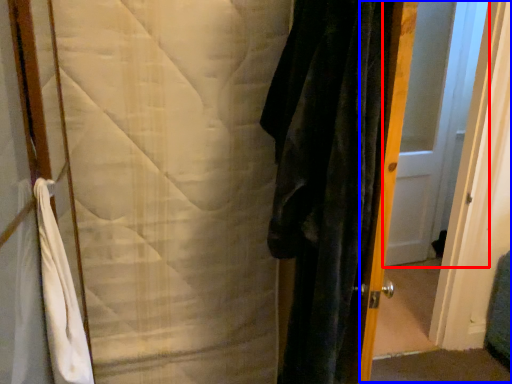
Question: Which object appears farthest to the camera in this image, door (highlighted by a red box) or screen door (highlighted by a blue box)?

Choices:
 (A) door
 (B) screen door

Answer: (A)